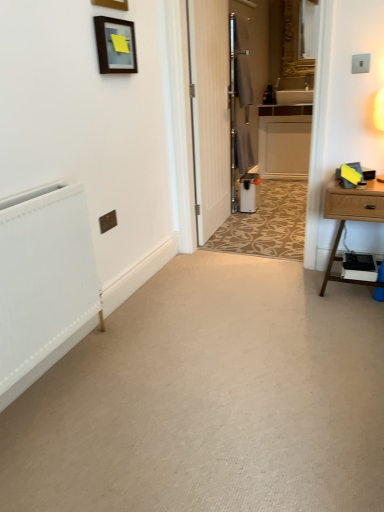
Question: Would you say matte black picture frame at upper left, the 1th picture frame from the bottom, is inside or outside white wood cabinet at center?

Choices:
 (A) inside
 (B) outside

Answer: (B)

Question: Based on their sizes in the image, would you say matte black picture frame at upper left, which ranks as the 2th picture frame in top-to-bottom order, is bigger or smaller than white wood cabinet at center?

Choices:
 (A) small
 (B) big

Answer: (A)

Question: Which object is the closest to the white textured radiator at left?

Choices:
 (A) white plastic air purifier at center
 (B) matte black picture frame at upper left, which ranks as the 2th picture frame in top-to-bottom order
 (C) silver metallic screen door at center
 (D) white wood cabinet at center
 (E) light brown wood nightstand at right

Answer: (B)

Question: Which object is positioned farthest from the matte wooden picture frame at upper center, placed as the second picture frame when sorted from bottom to top?

Choices:
 (A) light brown wood nightstand at right
 (B) silver metallic screen door at center
 (C) metallic rectangular at left
 (D) white wood cabinet at center
 (E) white plastic air purifier at center

Answer: (D)